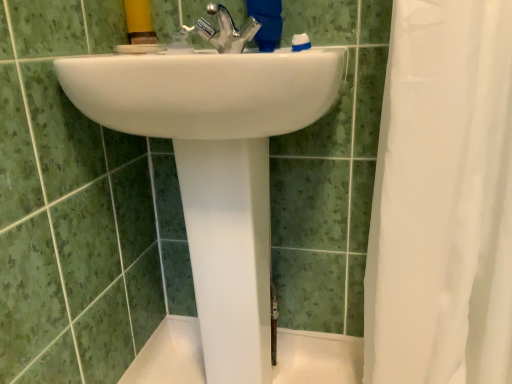
Question: Considering the positions of polished chrome faucet at center and white sheer fabric at right in the image, is polished chrome faucet at center wider or thinner than white sheer fabric at right?

Choices:
 (A) thin
 (B) wide

Answer: (A)

Question: From a real-world perspective, relative to white sheer fabric at right, is polished chrome faucet at center vertically above or below?

Choices:
 (A) below
 (B) above

Answer: (B)

Question: Based on their relative distances, which object is nearer to the polished chrome faucet at center?

Choices:
 (A) white sheer fabric at right
 (B) white glossy sink at center

Answer: (B)

Question: Considering the real-world distances, which object is closest to the polished chrome faucet at center?

Choices:
 (A) white glossy sink at center
 (B) white sheer fabric at right

Answer: (A)